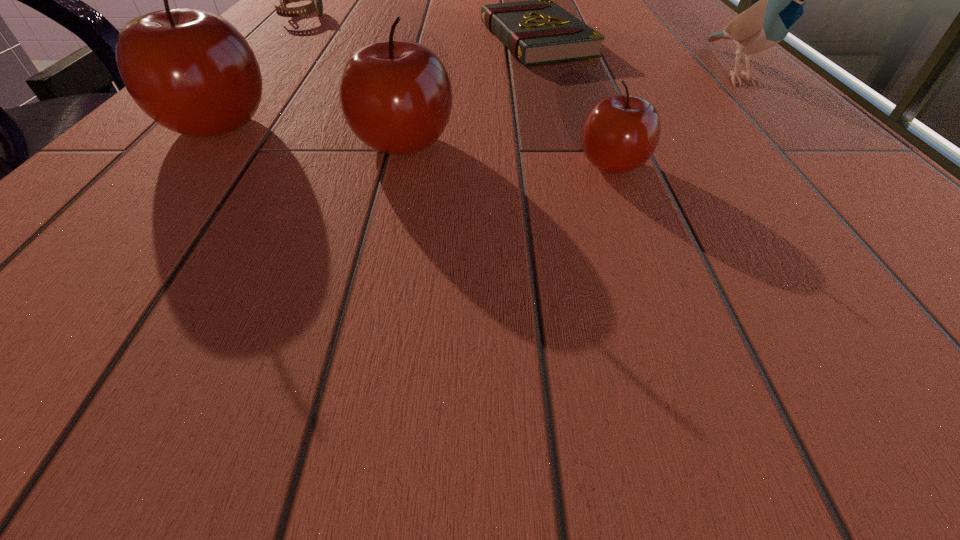
Identify the location of free location located 0.150m on the back of the rightmost apple. 587,95.

Image resolution: width=960 pixels, height=540 pixels. Find the location of `free location located 0.080m on the face of the second shortest object`. free location located 0.080m on the face of the second shortest object is located at coordinates (359, 17).

You are a GUI agent. You are given a task and a screenshot of the screen. Output one action in this format:
    pyautogui.click(x=<x>, y=<y>)
    Task: Click on the vacant space located 0.310m at the face of the bird
    This screenshot has height=540, width=960.
    Given the screenshot: What is the action you would take?
    pyautogui.click(x=911, y=251)

Identify the location of vacant point located 0.100m on the right of the book. (644, 40).

I want to click on apple that is at the left edge, so click(190, 70).

Find the location of a particular element. The width and height of the screenshot is (960, 540). watch that is at the left edge is located at coordinates (316, 6).

Identify the location of object that is at the right edge. This screenshot has width=960, height=540. (781, 3).

At what (x,y) coordinates should I click in order to perform the action: click on vacant space at the near edge of the desktop. Please return your answer as a coordinate pair (x, y). Image resolution: width=960 pixels, height=540 pixels. Looking at the image, I should click on (732, 251).

Image resolution: width=960 pixels, height=540 pixels. Find the location of `vacant space at the left edge of the desktop`. vacant space at the left edge of the desktop is located at coordinates (301, 31).

Where is `vacant space at the right edge`? vacant space at the right edge is located at coordinates (823, 218).